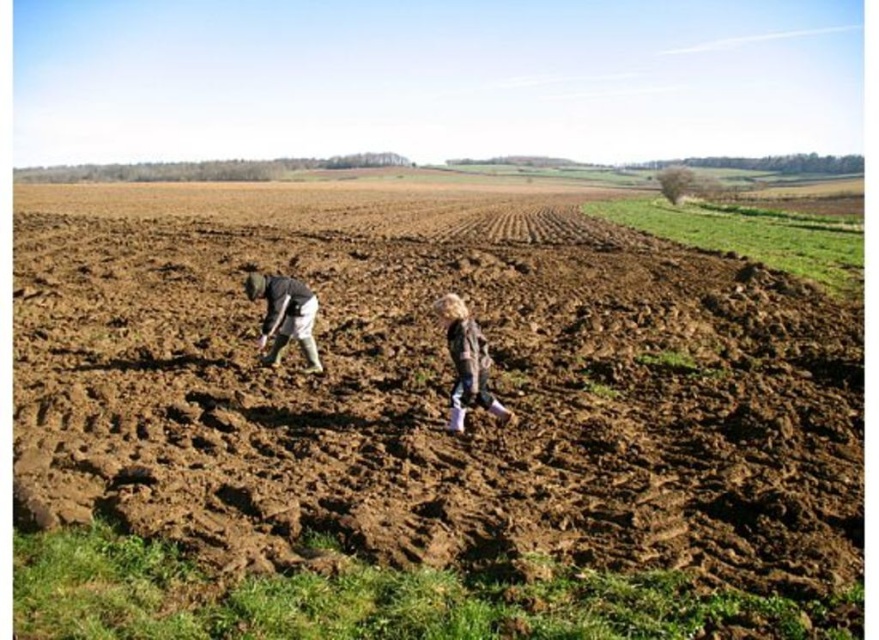
You are an observer standing at the edge of the field. You see the light brown fabric jacket at center and the dark gray fabric at lower left. Which one appears to be closer to you?

The light brown fabric jacket at center is smaller in size compared to the dark gray fabric at lower left, so it appears closer to you.

You are a farmer standing in the field and see the light brown fabric jacket at center and the dark gray fabric at lower left. Which one is closer to you?

The light brown fabric jacket at center is closer to you because it is in front of the dark gray fabric at lower left.